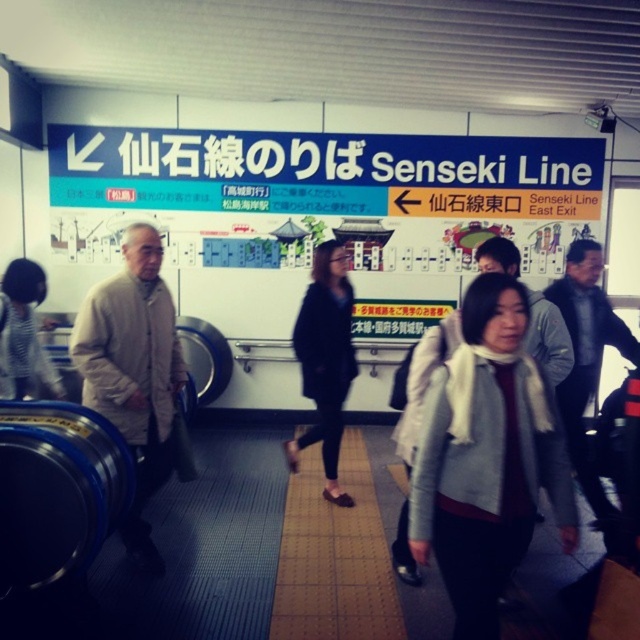
You are a commuter trying to decide whether to wear your white woolen scarf at center or your light beige sweater at left for warmth. Based on their sizes, which one could potentially cover more of your body?

The white woolen scarf at center might be wider than light beige sweater at left, so it could potentially cover more of your body depending on its length and how it is worn.

You are standing at the train station near the Senseki Line escalator. You see a black leather jacket at center and a striped fabric jacket at center. If you want to pick up both jackets but can only reach 1.8 meters, will you be able to reach both without moving?

The black leather jacket at center is 1.83 meters away from the striped fabric jacket at center. Since your reach is 1.8 meters, you cannot reach both jackets without moving.

You are standing at the train station near the Senseki Line escalator and see a person wearing a striped fabric jacket at center and holding a white woolen scarf at center. Which item is located more to the right side?

The white woolen scarf at center is positioned on the right side of striped fabric jacket at center, so it is more to the right side.